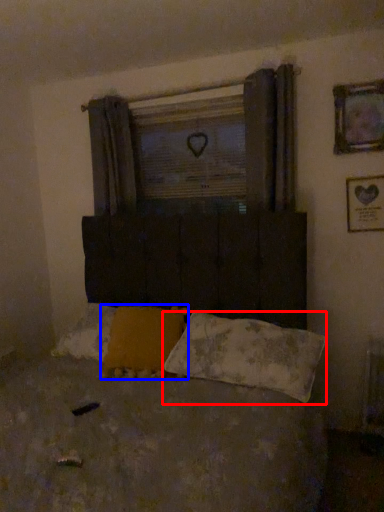
Question: Which object appears farthest to the camera in this image, pillow (highlighted by a red box) or pillow (highlighted by a blue box)?

Choices:
 (A) pillow
 (B) pillow

Answer: (B)